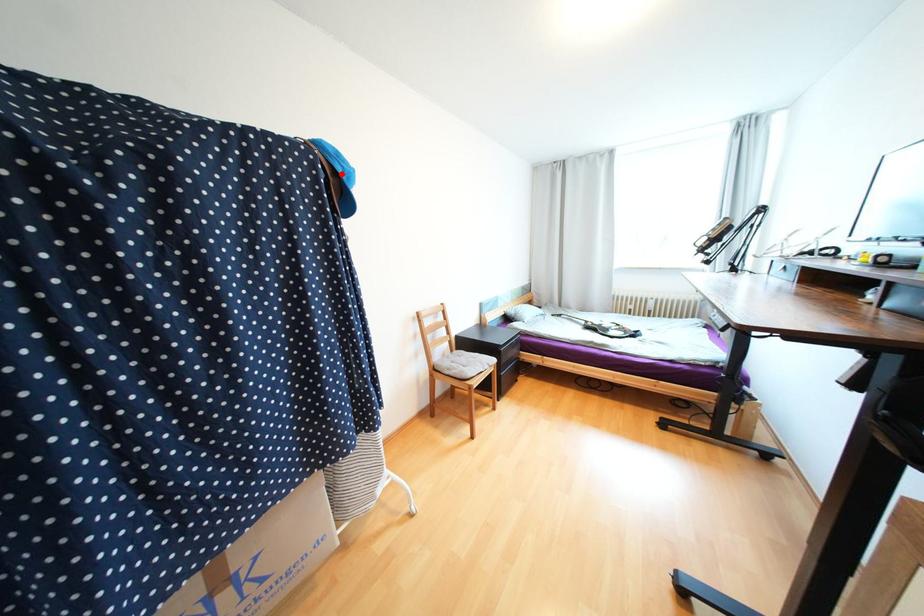
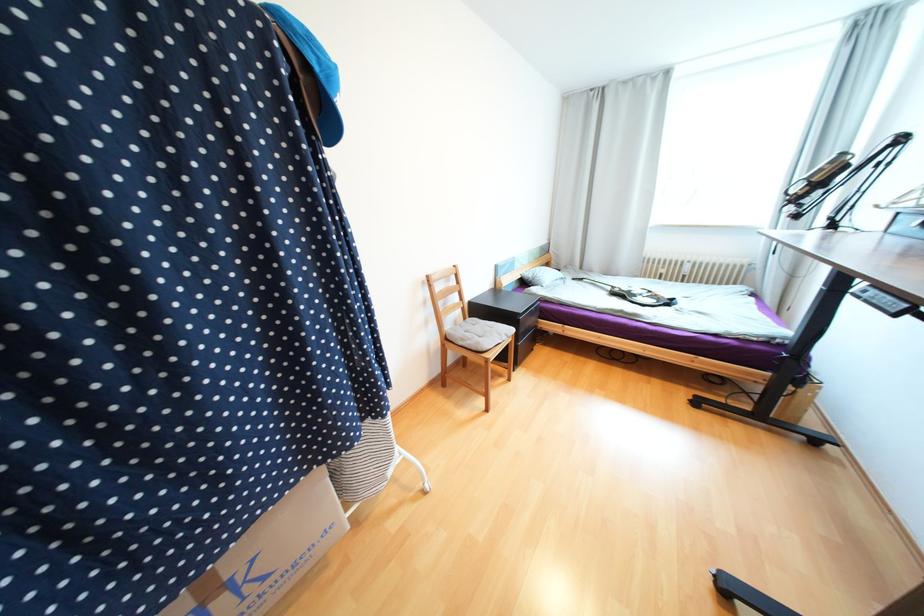
Locate, in the second image, the point that corresponds to the highlighted location in the first image.

(312, 67)